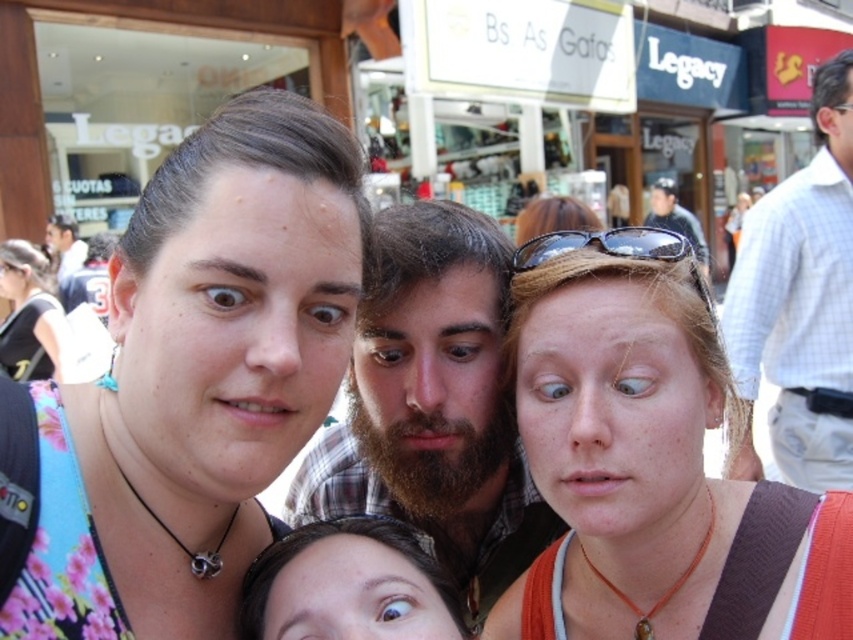
Does point (592, 515) come behind point (546, 232)?

No.

Can you confirm if matte orange necklace at center is positioned to the right of black plastic sunglasses at upper center?

Incorrect, matte orange necklace at center is not on the right side of black plastic sunglasses at upper center.

Is point (654, 493) in front of point (677, 237)?

Yes, point (654, 493) is closer to viewer.

This screenshot has width=853, height=640. Find the location of `matte orange necklace at center`. matte orange necklace at center is located at coordinates (651, 465).

Between bearded man at center and white checkered shirt at right, which one has less height?

white checkered shirt at right is shorter.

You are a GUI agent. You are given a task and a screenshot of the screen. Output one action in this format:
    pyautogui.click(x=<x>, y=<y>)
    Task: Click on the bearded man at center
    The width and height of the screenshot is (853, 640).
    Given the screenshot: What is the action you would take?
    pyautogui.click(x=433, y=404)

Locate an element on the screen. The height and width of the screenshot is (640, 853). bearded man at center is located at coordinates (433, 404).

Can you confirm if smooth brown hair at center is bigger than black reflective sunglasses at upper center?

Yes.

Does smooth brown hair at center come behind black reflective sunglasses at upper center?

No, it is not.

Is point (328, 618) behind point (619, 252)?

No, it is not.

Where is `smooth brown hair at center`? The width and height of the screenshot is (853, 640). smooth brown hair at center is located at coordinates (345, 582).